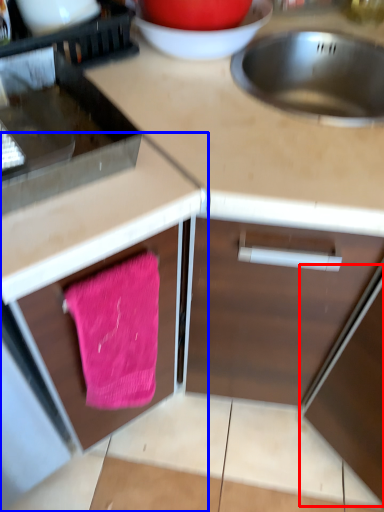
Question: Which point is further to the camera, appliance (highlighted by a red box) or cabinetry (highlighted by a blue box)?

Choices:
 (A) appliance
 (B) cabinetry

Answer: (A)